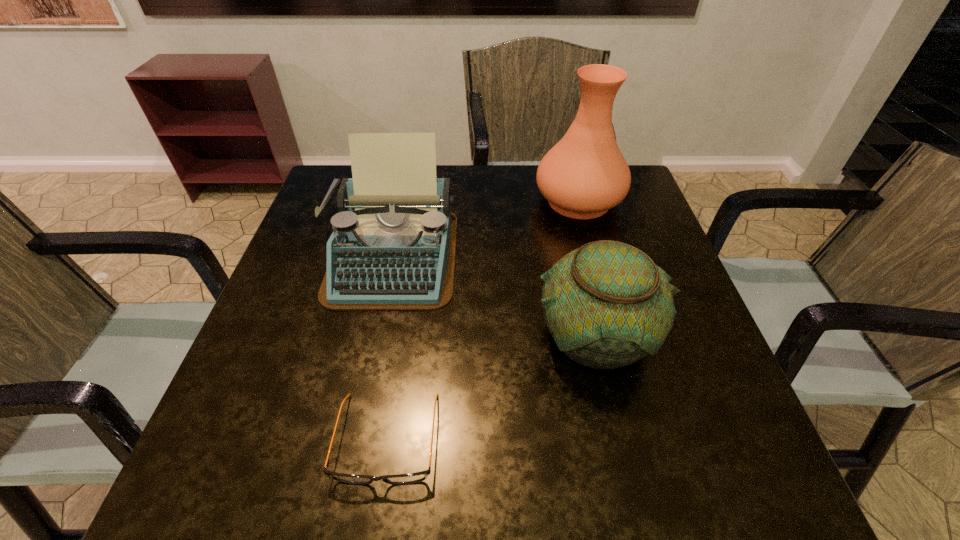
Where is `the tallest object`? the tallest object is located at coordinates (584, 175).

Where is `typewriter`? typewriter is located at coordinates (393, 247).

Where is `the second shortest object`? the second shortest object is located at coordinates [x=606, y=304].

Locate an element on the screen. Image resolution: width=960 pixels, height=540 pixels. the shortest object is located at coordinates (399, 479).

You are a GUI agent. You are given a task and a screenshot of the screen. Output one action in this format:
    pyautogui.click(x=<x>, y=<y>)
    Task: Click on the nearest object
    This screenshot has height=540, width=960.
    Given the screenshot: What is the action you would take?
    pyautogui.click(x=399, y=479)

Find the location of `vacant region located on the front of the tallest object`. vacant region located on the front of the tallest object is located at coordinates (591, 247).

This screenshot has width=960, height=540. In order to click on vacant space located on the typing side of the typewriter in this screenshot , I will do `click(357, 425)`.

I want to click on vacant space located 0.170m on the back of the third tallest object, so pos(572,240).

The width and height of the screenshot is (960, 540). In order to click on vase located at the far edge in this screenshot , I will do `click(584, 175)`.

You are a GUI agent. You are given a task and a screenshot of the screen. Output one action in this format:
    pyautogui.click(x=<x>, y=<y>)
    Task: Click on the typewriter that is at the far edge
    The height and width of the screenshot is (540, 960).
    Given the screenshot: What is the action you would take?
    pyautogui.click(x=393, y=247)